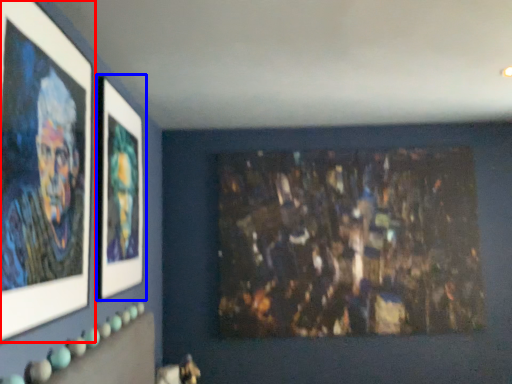
Question: Which object appears farthest to the camera in this image, picture frame (highlighted by a red box) or picture frame (highlighted by a blue box)?

Choices:
 (A) picture frame
 (B) picture frame

Answer: (B)